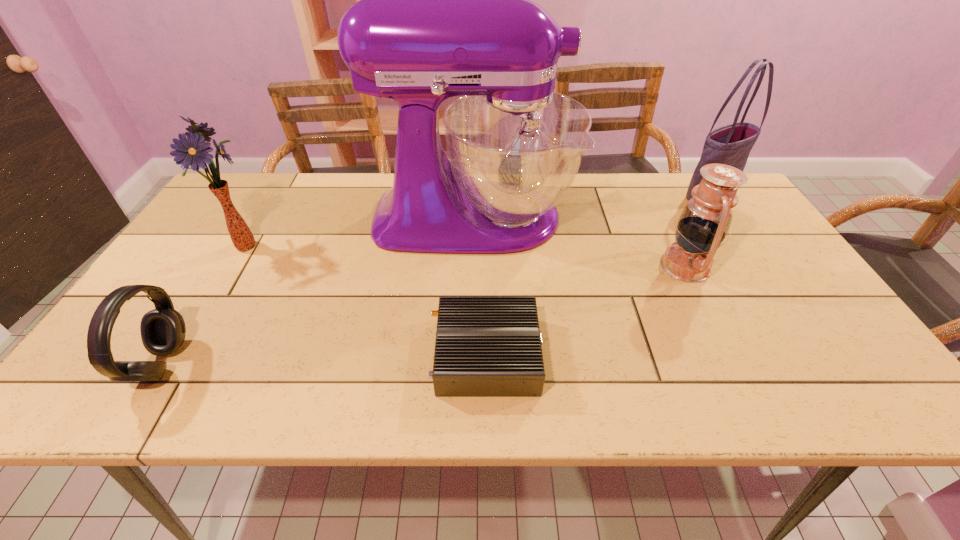
The height and width of the screenshot is (540, 960). Find the location of `vacant region located 0.310m on the front of the third shortest object`. vacant region located 0.310m on the front of the third shortest object is located at coordinates (753, 403).

Identify the location of vacant space located 0.090m on the earcups of the fifth tallest object. Image resolution: width=960 pixels, height=540 pixels. (223, 363).

Locate an element on the screen. Image resolution: width=960 pixels, height=540 pixels. blank space located on the back panel of the router is located at coordinates (397, 355).

Find the location of a particular element. Image resolution: width=960 pixels, height=540 pixels. free location located 0.120m on the back panel of the router is located at coordinates pos(374,355).

Where is `blank space located on the back panel of the router`? blank space located on the back panel of the router is located at coordinates (397, 355).

You are a GUI agent. You are given a task and a screenshot of the screen. Output one action in this format:
    pyautogui.click(x=<x>, y=<y>)
    Task: Click on the mixer located in the far edge section of the desktop
    
    Given the screenshot: What is the action you would take?
    tap(445, 9)

You are a GUI agent. You are given a task and a screenshot of the screen. Output one action in this format:
    pyautogui.click(x=<x>, y=<y>)
    Task: Click on the tote bag present at the far edge
    This screenshot has width=960, height=540.
    Given the screenshot: What is the action you would take?
    pyautogui.click(x=731, y=144)

Where is `headset positioned at the near edge`? The image size is (960, 540). headset positioned at the near edge is located at coordinates (162, 329).

The width and height of the screenshot is (960, 540). In order to click on router positioned at the near edge in this screenshot , I will do `click(485, 346)`.

You are a GUI agent. You are given a task and a screenshot of the screen. Output one action in this format:
    pyautogui.click(x=<x>, y=<y>)
    Task: Click on the flower arrangement present at the left edge
    This screenshot has height=540, width=960.
    Given the screenshot: What is the action you would take?
    click(x=193, y=151)